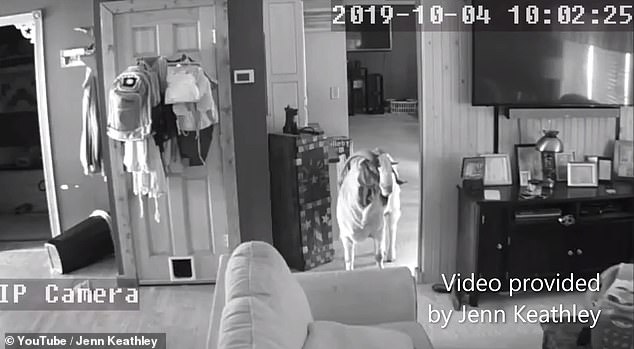
At what (x,y) coordinates should I click in order to perform the action: click on floor. Please return your answer as a coordinate pair (x, y). Looking at the image, I should click on (193, 304), (532, 321).